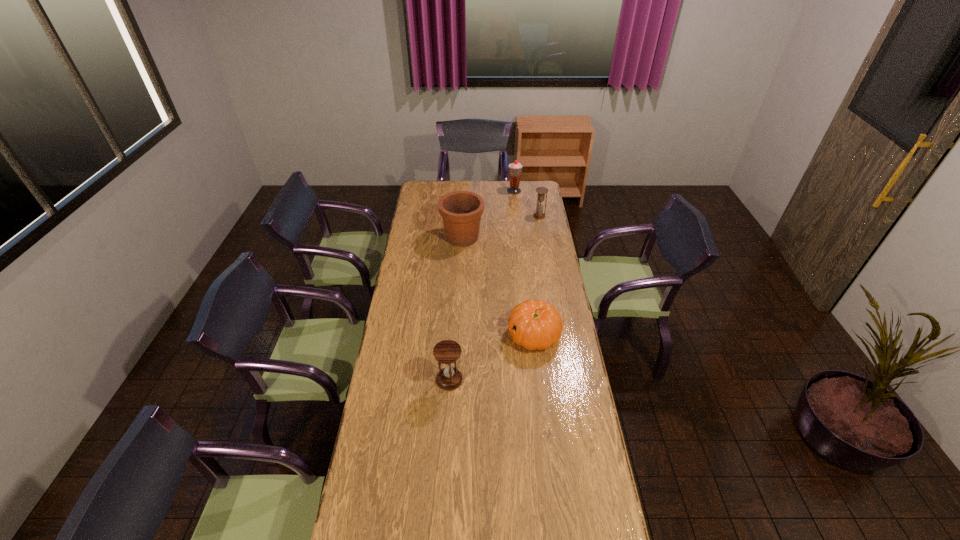
The image size is (960, 540). What are the coordinates of `free space at the right edge of the desktop` in the screenshot? It's located at (549, 258).

This screenshot has width=960, height=540. Find the location of `free space at the far right corner of the desktop`. free space at the far right corner of the desktop is located at coordinates pyautogui.click(x=525, y=181).

What are the coordinates of `free space between the fourth nearest object and the third nearest object` in the screenshot? It's located at (501, 227).

You are a GUI agent. You are given a task and a screenshot of the screen. Output one action in this format:
    pyautogui.click(x=<x>, y=<y>)
    Task: Click on the vacant area between the farthest object and the flowerpot
    
    Given the screenshot: What is the action you would take?
    pyautogui.click(x=489, y=214)

Find the location of a particular element. free area in between the farther hourglass and the left hourglass is located at coordinates tap(494, 298).

The height and width of the screenshot is (540, 960). Identify the location of empty space between the pumpkin and the left hourglass. (492, 357).

Identify the location of vacant space that's between the fourth farthest object and the right hourglass. (537, 275).

The image size is (960, 540). In order to click on free space between the fourth nearest object and the fourth farthest object in this screenshot , I will do `click(537, 275)`.

The height and width of the screenshot is (540, 960). I want to click on free spot between the fourth farthest object and the smoothie, so click(524, 263).

Where is `object that is the fourth closest to the left hourglass`? This screenshot has width=960, height=540. object that is the fourth closest to the left hourglass is located at coordinates (515, 168).